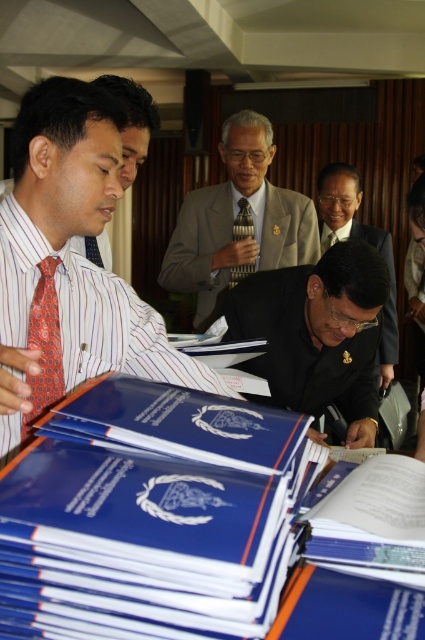
Is blue hardcover book at center bigger than orange patterned tie at left?

Yes.

Is point (124, 440) positioned before point (33, 300)?

Yes, it is in front of point (33, 300).

The height and width of the screenshot is (640, 425). In order to click on blue hardcover book at center in this screenshot , I will do `click(138, 545)`.

Is point (218, 396) in front of point (385, 381)?

Yes, it is.

Where is `blue matte book at center`? This screenshot has height=640, width=425. blue matte book at center is located at coordinates (184, 422).

Does point (172, 385) come behind point (390, 349)?

That is False.

This screenshot has height=640, width=425. Find the location of `blue matte book at center`. blue matte book at center is located at coordinates (184, 422).

Can you confirm if matte red tie at left is thinner than orange patterned tie at left?

No, matte red tie at left is not thinner than orange patterned tie at left.

Who is more forward, (54, 141) or (42, 340)?

Positioned in front is point (54, 141).

Between point (150, 307) and point (51, 384), which one is positioned in front?

Point (51, 384) is more forward.

Where is `matte red tie at left`? The image size is (425, 640). matte red tie at left is located at coordinates (68, 244).